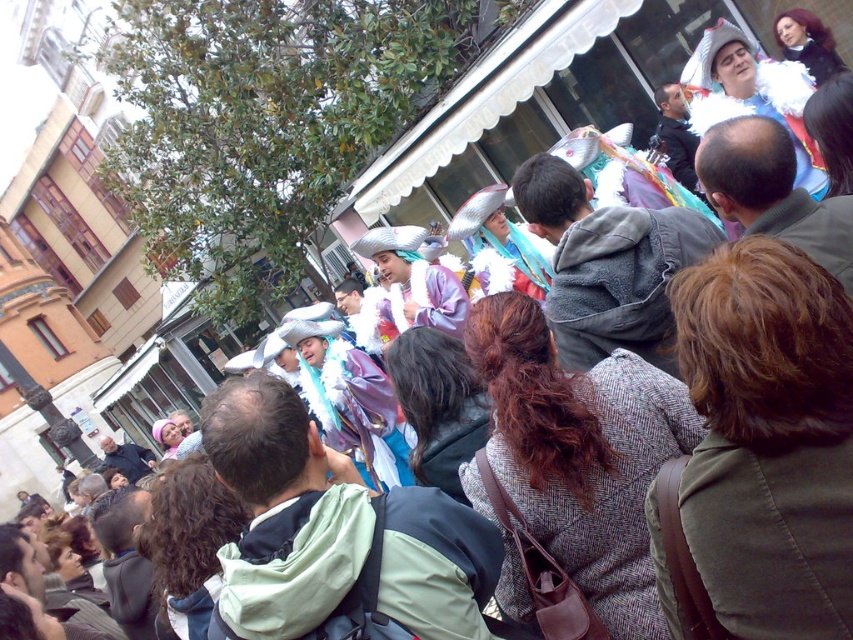
You are a photographer at the event and want to capture a photo of both the white fluffy hat at upper right and the shiny black hair at upper right. Which object should you focus on first to ensure both are in focus?

The white fluffy hat at upper right is closer to the viewer than the shiny black hair at upper right. To ensure both are in focus, you should focus on the white fluffy hat at upper right first, as focusing on the closer object allows the background object to be in focus as well.

You are a photographer standing at the back of the crowd. You want to take a photo of the white fluffy hat at upper right and the shiny black hair at upper right so that both are clearly visible in the frame. Given that your camera has a maximum focus range of 4 meters, will you be able to capture both objects in sharp focus?

The white fluffy hat at upper right is 4.58 meters away from the shiny black hair at upper right. Since the distance between them exceeds the camera focus range of 4 meters, you may not be able to capture both in sharp focus simultaneously.

You are a photographer trying to capture a clear photo of the dark brown curly hair at center. However, the brown wool coat at center is blocking your view. Can you move around to the side to get an unobstructed shot?

The brown wool coat at center is in front of dark brown curly hair at center, so moving to the side might allow you to capture the dark brown curly hair at center without obstruction.